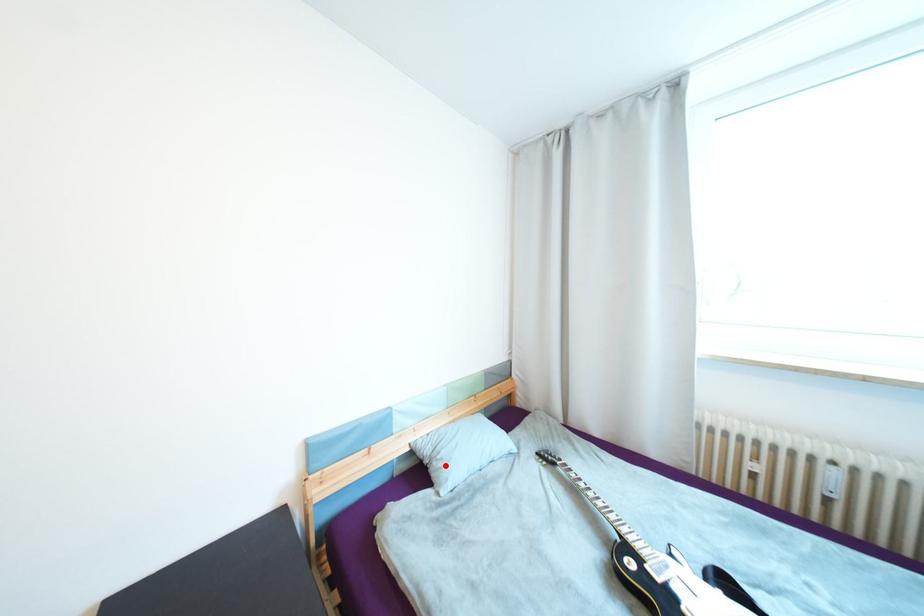
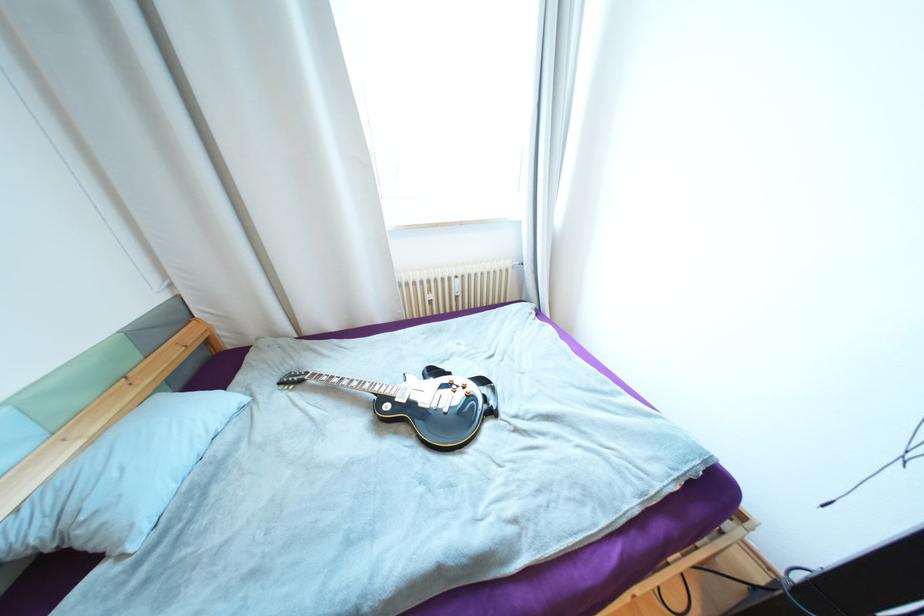
Find the pixel in the second image that matches the highlighted location in the first image.

(101, 525)